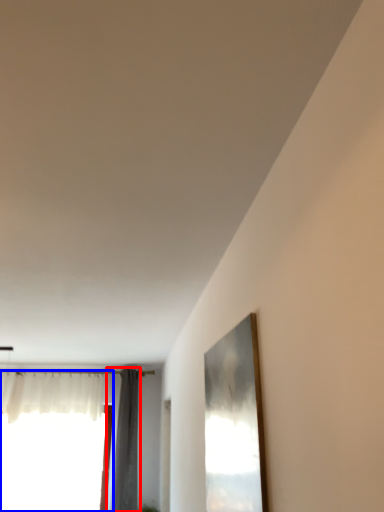
Question: Which point is closer to the camera, curtain (highlighted by a red box) or window (highlighted by a blue box)?

Choices:
 (A) curtain
 (B) window

Answer: (A)